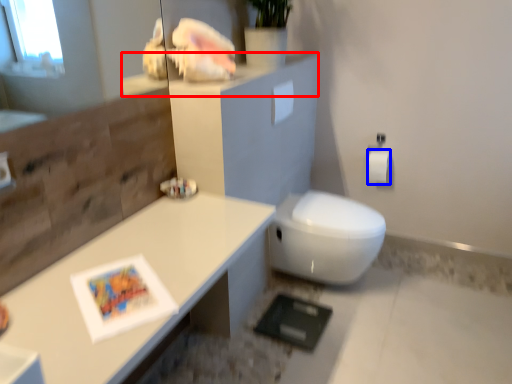
Question: Among these objects, which one is nearest to the camera, ledge (highlighted by a red box) or toilet paper (highlighted by a blue box)?

Choices:
 (A) ledge
 (B) toilet paper

Answer: (A)